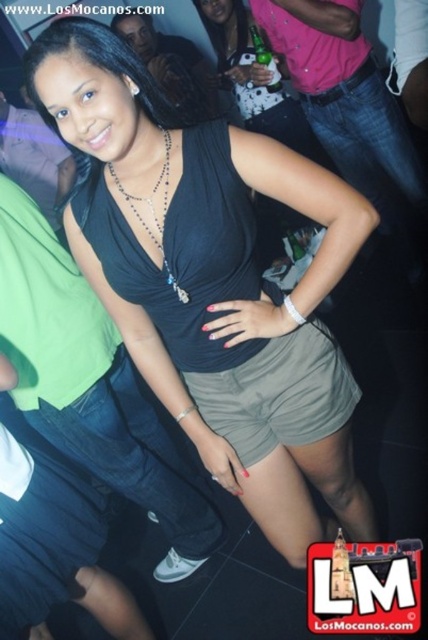
Is black matte tank top at center to the left of silver beaded necklace at center from the viewer's perspective?

No, black matte tank top at center is not to the left of silver beaded necklace at center.

Is point (350, 476) more distant than point (166, 132)?

Yes, it is.

The height and width of the screenshot is (640, 428). I want to click on black matte tank top at center, so click(201, 266).